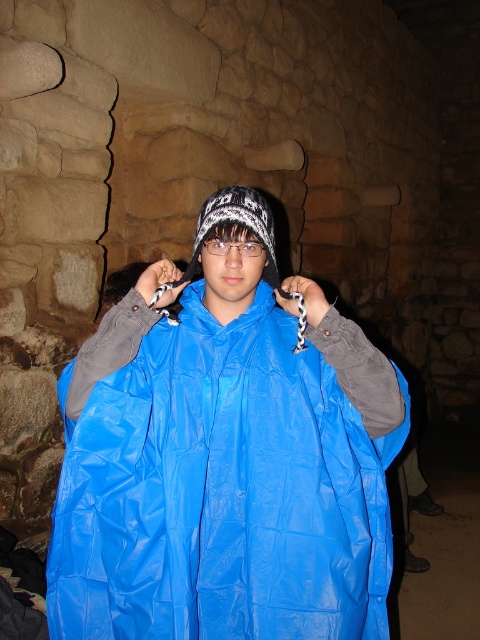
Question: Which point is closer to the camera taking this photo?

Choices:
 (A) 267,253
 (B) 188,376

Answer: (B)

Question: Does blue shiny raincoat at center lie behind white knitted hat at center?

Choices:
 (A) no
 (B) yes

Answer: (A)

Question: Can you confirm if blue shiny raincoat at center is bigger than white knitted hat at center?

Choices:
 (A) no
 (B) yes

Answer: (B)

Question: Is blue shiny raincoat at center wider than white knitted hat at center?

Choices:
 (A) no
 (B) yes

Answer: (B)

Question: Which point appears farthest from the camera in this image?

Choices:
 (A) (286, 296)
 (B) (340, 353)

Answer: (A)